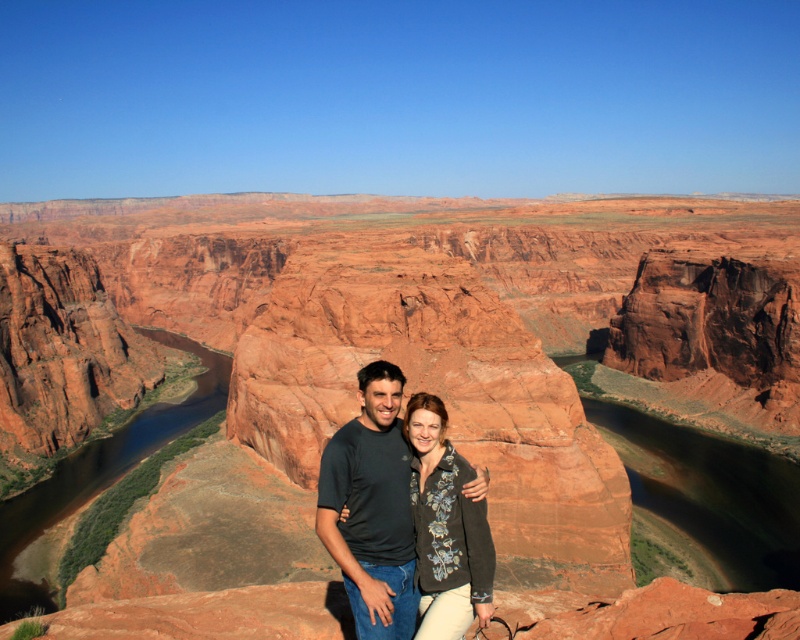
Based on the photo, who is more distant from viewer, (696, 493) or (448, 493)?

Positioned behind is point (696, 493).

Locate an element on the screen. brown smooth water at center is located at coordinates click(704, 502).

Can you confirm if reddish-brown rock formation at center is positioned to the right of matte black shirt at center?

No, reddish-brown rock formation at center is not to the right of matte black shirt at center.

Between point (680, 250) and point (332, 548), which one is positioned behind?

The point (680, 250) is more distant.

Measure the distance between reddish-brown rock formation at center and camera.

reddish-brown rock formation at center is 239.11 feet from camera.

At what (x,y) coordinates should I click in order to perform the action: click on reddish-brown rock formation at center. Please return your answer as a coordinate pair (x, y). The image size is (800, 640). Looking at the image, I should click on (413, 330).

Can you confirm if matte black shirt at center is bigger than brown smooth river at center?

No.

Who is more forward, (398,563) or (6,502)?

Point (398,563) is in front.

Is point (392, 522) positioned in front of point (88, 499)?

Yes, it is in front of point (88, 499).

Identify the location of matte black shirt at center. The height and width of the screenshot is (640, 800). (372, 508).